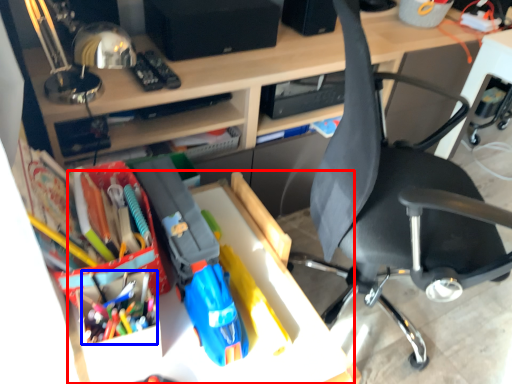
Question: Which point is closer to the camera, table (highlighted by a red box) or stationery (highlighted by a blue box)?

Choices:
 (A) table
 (B) stationery

Answer: (A)